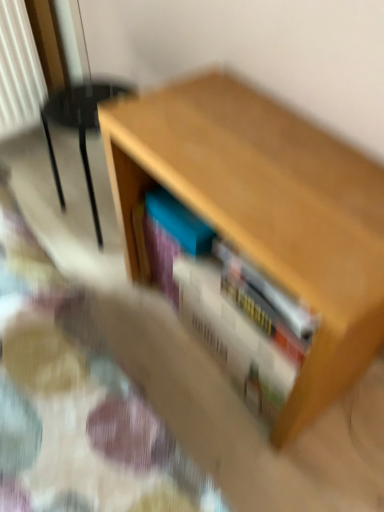
This screenshot has height=512, width=384. What are the coordinates of `blank space situated above wooden table at center (from a real-world perspective)` in the screenshot? It's located at (263, 158).